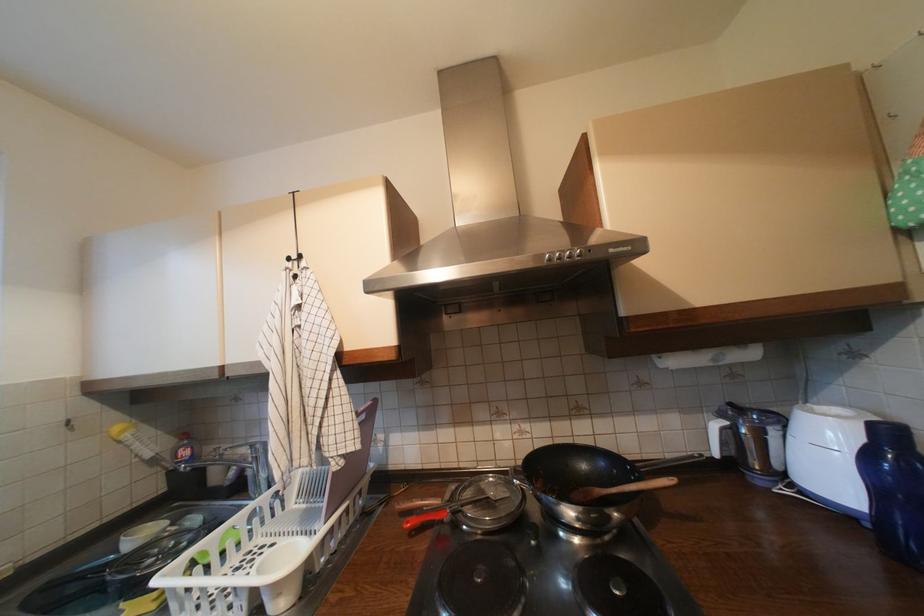
This screenshot has width=924, height=616. Describe the element at coordinates (295, 232) in the screenshot. I see `a black hanging hook` at that location.